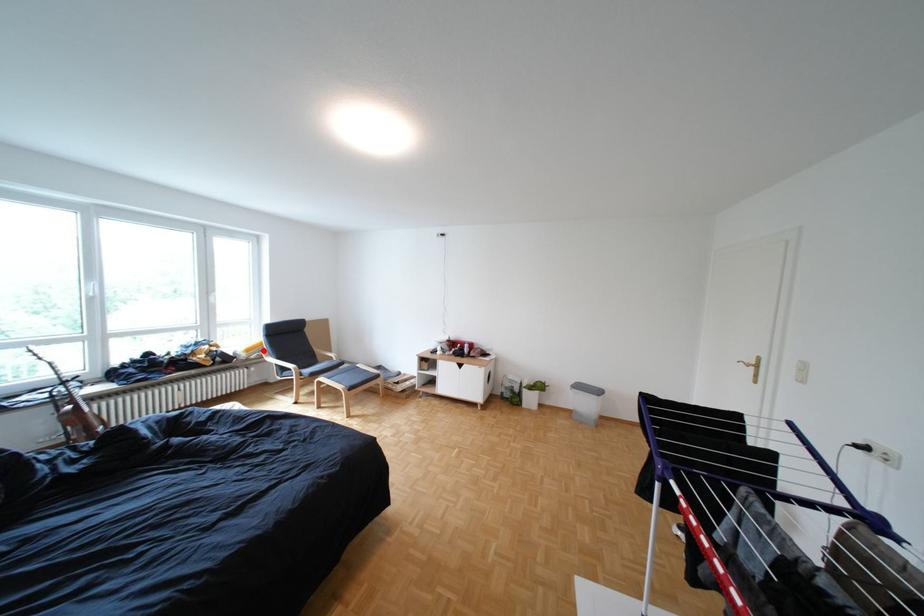
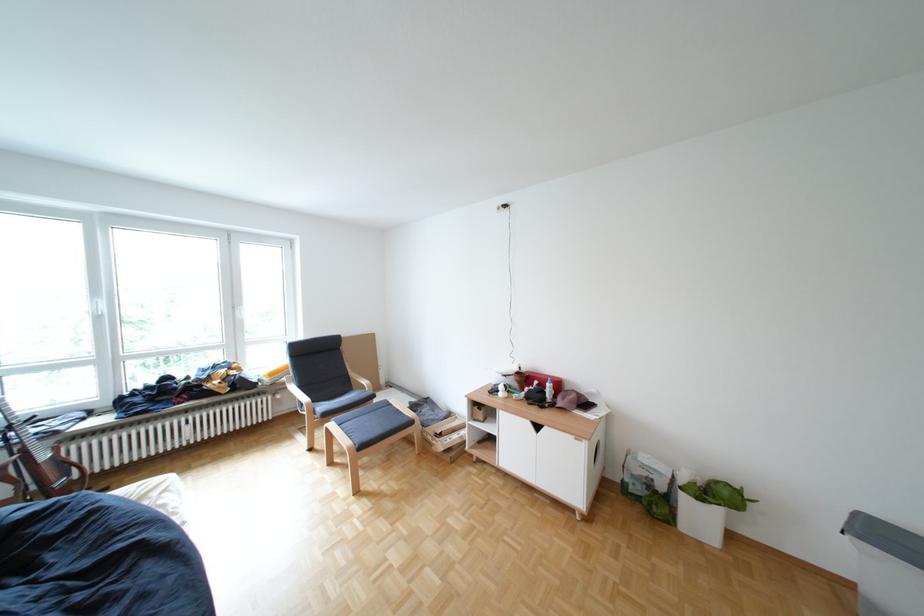
The point at the highlighted location is marked in the first image. Where is the corresponding point in the second image?

(286, 374)